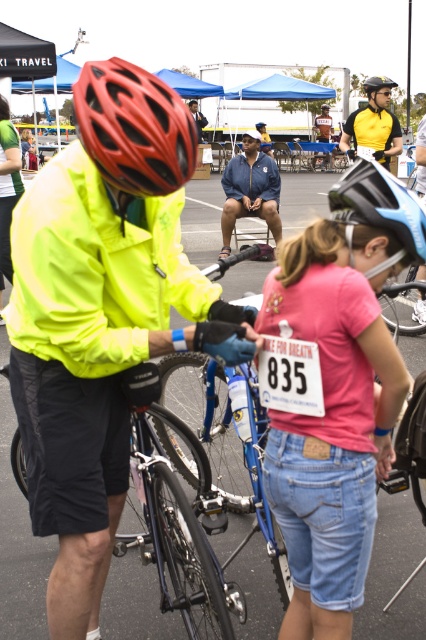
Describe the element at coordinates (134, 129) in the screenshot. This screenshot has width=426, height=640. I see `shiny red helmet at upper left` at that location.

What do you see at coordinates (134, 129) in the screenshot? I see `shiny red helmet at upper left` at bounding box center [134, 129].

Locate an element on the screen. The height and width of the screenshot is (640, 426). shiny red helmet at upper left is located at coordinates (134, 129).

Can you confirm if pink fabric shirt at center is smaller than yellow matte safety vest at upper center?

Actually, pink fabric shirt at center might be larger than yellow matte safety vest at upper center.

How far apart are pink fabric shirt at center and yellow matte safety vest at upper center?

A distance of 19.72 feet exists between pink fabric shirt at center and yellow matte safety vest at upper center.

Locate an element on the screen. This screenshot has height=640, width=426. pink fabric shirt at center is located at coordinates (333, 390).

Where is `pink fabric shirt at center`? pink fabric shirt at center is located at coordinates (333, 390).

Is point (389, 248) positioned after point (380, 76)?

No, (389, 248) is in front of (380, 76).

Does pink fabric shirt at center have a greater height compared to shiny black helmet at upper center?

No.

Where is `pink fabric shirt at center`? This screenshot has width=426, height=640. pink fabric shirt at center is located at coordinates (333, 390).